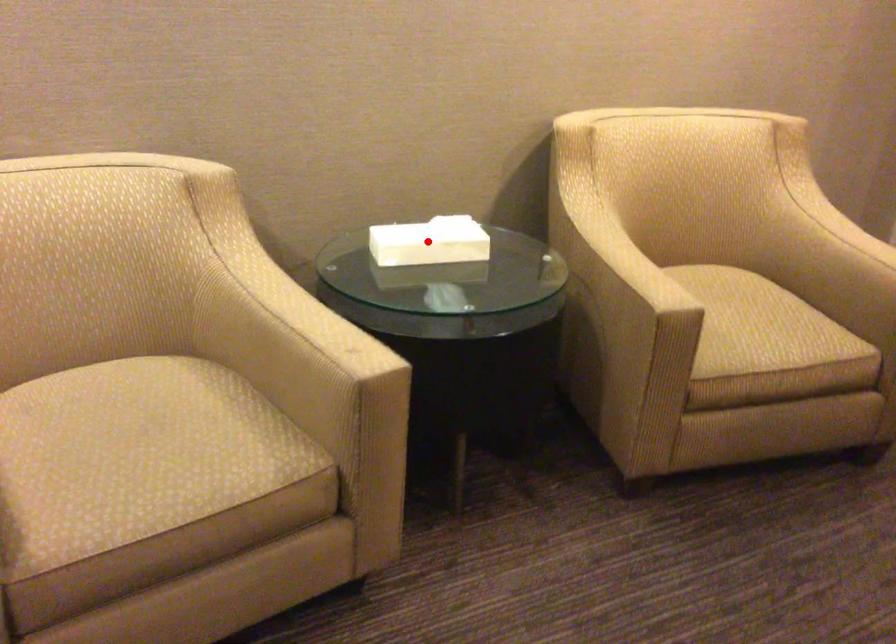
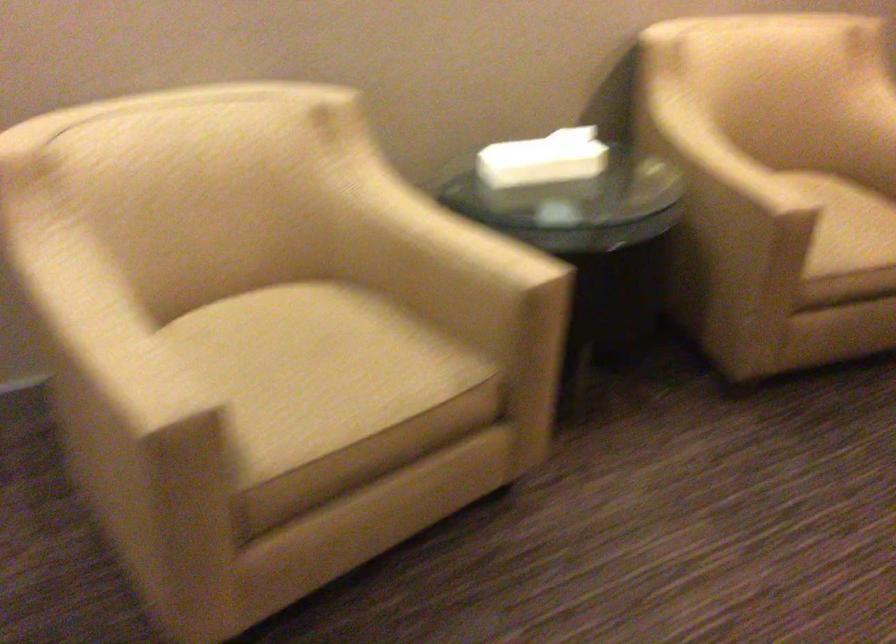
Where in the second image is the point corresponding to the highlighted location from the first image?

(543, 158)